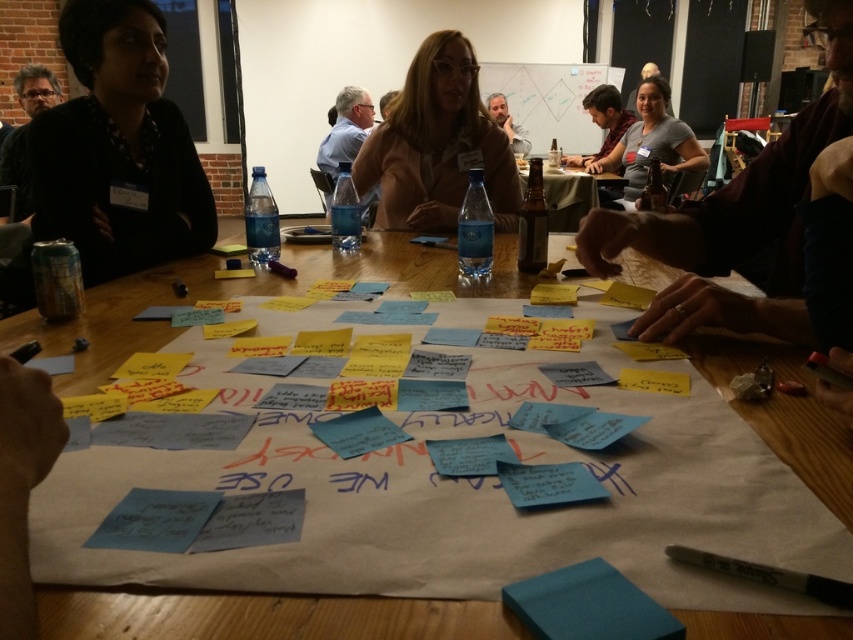
Which is above, black fabric shirt at left or matte brown jacket at center?

matte brown jacket at center

Is black fabric shirt at left above matte brown jacket at center?

No.

At what (x,y) coordinates should I click in order to perform the action: click on black fabric shirt at left. Please return your answer as a coordinate pair (x, y). The height and width of the screenshot is (640, 853). Looking at the image, I should click on (119, 148).

Is point (802, 435) positioned before point (610, 115)?

Yes, point (802, 435) is closer to viewer.

Is point (186, 627) more distant than point (582, 99)?

That is False.

Does point (57, 388) lie behind point (610, 131)?

No, (57, 388) is in front of (610, 131).

What are the coordinates of `white paper at center` in the screenshot? It's located at (260, 616).

Who is taller, white paper at center or dark gray shirt at upper right?

Standing taller between the two is dark gray shirt at upper right.

Between white paper at center and dark gray shirt at upper right, which one has less height?

white paper at center

The width and height of the screenshot is (853, 640). Describe the element at coordinates (260, 616) in the screenshot. I see `white paper at center` at that location.

Where is `white paper at center`? white paper at center is located at coordinates (260, 616).